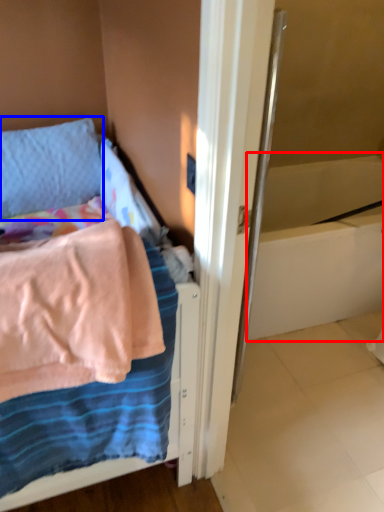
Question: Which point is closer to the camera, bath (highlighted by a red box) or pillow (highlighted by a blue box)?

Choices:
 (A) bath
 (B) pillow

Answer: (B)